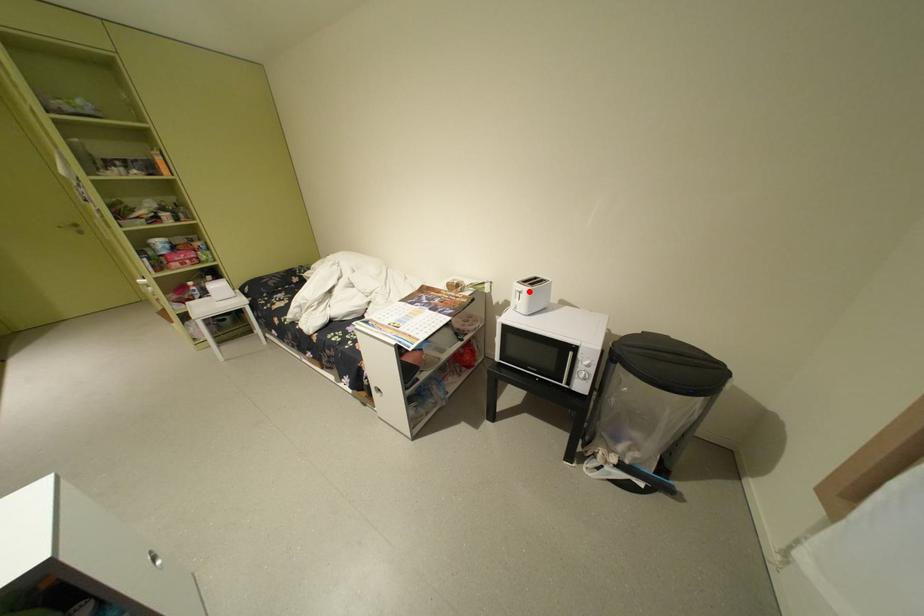
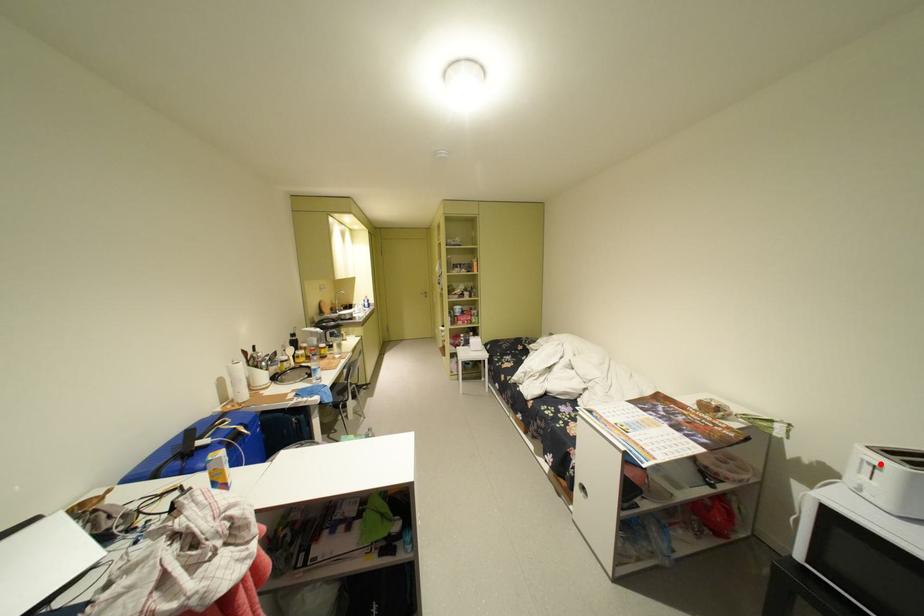
I am providing you with two images of the same scene from different viewpoints. A red point is marked on the first image and another point is marked on the second image. Are the points marked in image1 and image2 representing the same 3D position?

Yes